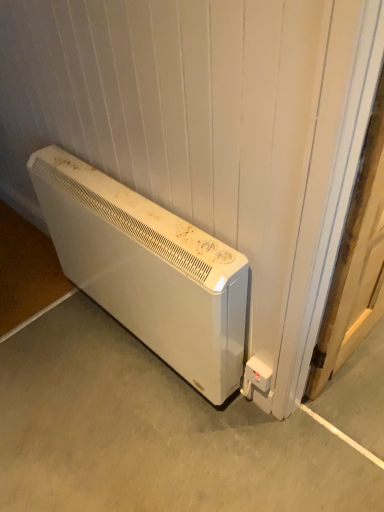
Question: Is white matte heater at lower left situated inside wooden door at right or outside?

Choices:
 (A) outside
 (B) inside

Answer: (A)

Question: From their relative heights in the image, would you say white matte heater at lower left is taller or shorter than wooden door at right?

Choices:
 (A) tall
 (B) short

Answer: (B)

Question: Estimate the real-world distances between objects in this image. Which object is farther from the white plastic electric outlet at lower right?

Choices:
 (A) white matte heater at lower left
 (B) white matte heater at lower left
 (C) wooden door at right

Answer: (A)

Question: Based on their relative distances, which object is farther from the white matte heater at lower left?

Choices:
 (A) white matte heater at lower left
 (B) white plastic electric outlet at lower right
 (C) wooden door at right

Answer: (C)